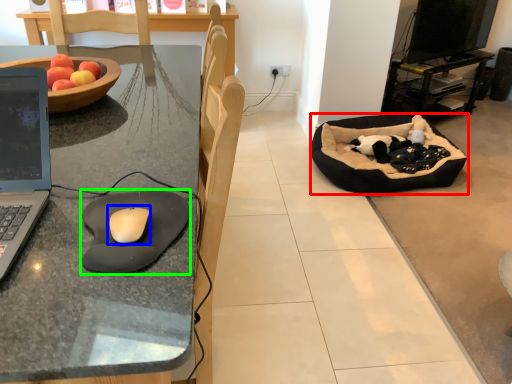
Question: Estimate the real-world distances between objects in this image. Which object is closer to dog bed (highlighted by a red box), mouse (highlighted by a blue box) or mousepad (highlighted by a green box)?

Choices:
 (A) mouse
 (B) mousepad

Answer: (B)